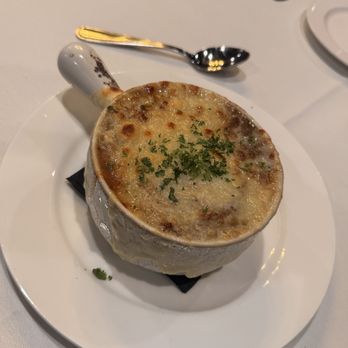
At what (x,y) coordinates should I click in order to perform the action: click on round part of the bowl that holds food. Please return your answer as a coordinate pair (x, y). The width and height of the screenshot is (348, 348). Looking at the image, I should click on (147, 244).